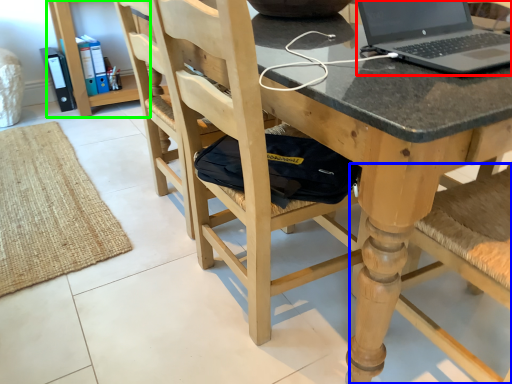
Question: Considering the real-world distances, which object is closest to laptop (highlighted by a red box)? chair (highlighted by a blue box) or bookshelf (highlighted by a green box).

Choices:
 (A) chair
 (B) bookshelf

Answer: (A)